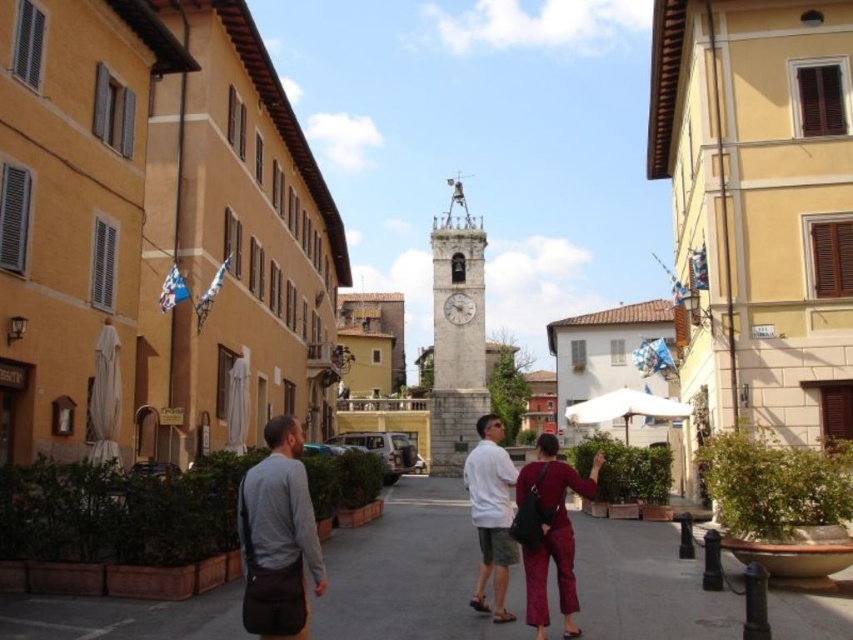
Between point (607, 627) and point (543, 596), which one is positioned in front?

Positioned in front is point (607, 627).

Who is more distant from viewer, (169, 605) or (547, 477)?

Positioned behind is point (547, 477).

Between point (434, 532) and point (537, 609), which one is positioned behind?

Point (434, 532)

Identify the location of dark gray asphalt at center. The width and height of the screenshot is (853, 640). (410, 572).

Is dark gray asphalt at center below gray fabric bag at lower left?

Yes, dark gray asphalt at center is below gray fabric bag at lower left.

Is dark gray asphalt at center smaller than gray fabric bag at lower left?

No, dark gray asphalt at center is not smaller than gray fabric bag at lower left.

Does point (369, 627) come closer to viewer compared to point (289, 476)?

No, (369, 627) is further to viewer.

You are a GUI agent. You are given a task and a screenshot of the screen. Output one action in this format:
    pyautogui.click(x=<x>, y=<y>)
    Task: Click on the dark gray asphalt at center
    Image resolution: width=853 pixels, height=640 pixels.
    Given the screenshot: What is the action you would take?
    pyautogui.click(x=410, y=572)

Can you confirm if maroon fabric pants at center is positioned above gray fabric bag at lower left?

No.

Between maroon fabric pants at center and gray fabric bag at lower left, which one has less height?

gray fabric bag at lower left is shorter.

Is point (492, 472) less distant than point (289, 476)?

No, it is behind (289, 476).

I want to click on maroon fabric pants at center, so click(532, 516).